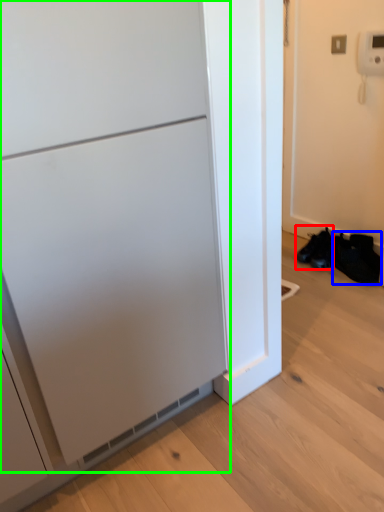
Question: Which is farther away from footwear (highlighted by a red box)? shoe (highlighted by a blue box) or appliance (highlighted by a green box)?

Choices:
 (A) shoe
 (B) appliance

Answer: (B)